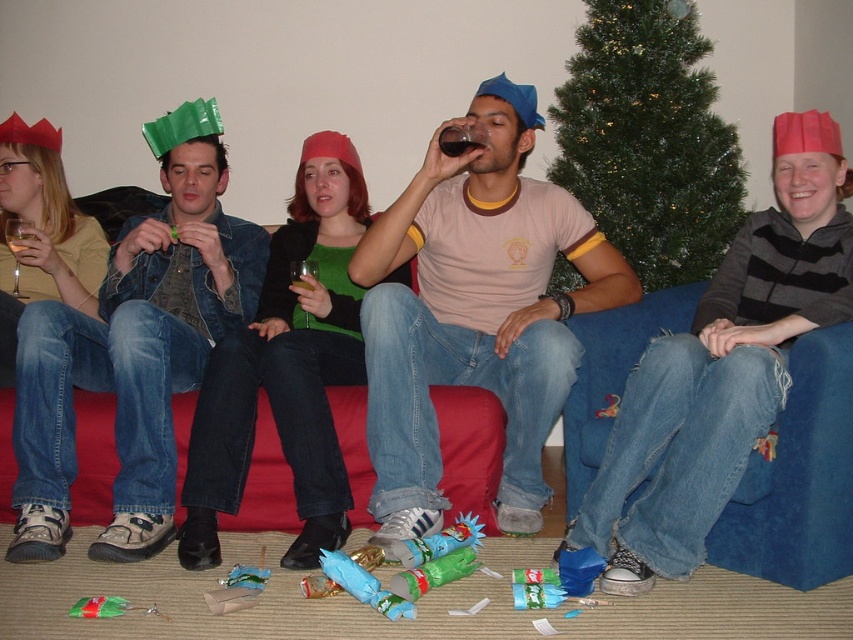
Question: Which point is farther to the camera?

Choices:
 (A) green artificial christmas tree at upper center
 (B) translucent glass at center

Answer: (A)

Question: Which of the following is the closest to the observer?

Choices:
 (A) (808, 529)
 (B) (135, 234)
 (C) (498, 152)

Answer: (A)

Question: Is matte pink t-shirt at center bigger than denim jacket at left?

Choices:
 (A) yes
 (B) no

Answer: (A)

Question: Does denim jacket at left appear under transparent glass at upper left?

Choices:
 (A) yes
 (B) no

Answer: (A)

Question: Which is nearer to the blue suede couch at lower right?

Choices:
 (A) green artificial christmas tree at upper center
 (B) transparent glass at upper left
 (C) translucent glass at center

Answer: (A)

Question: Is green artificial christmas tree at upper center above transparent glass at upper left?

Choices:
 (A) yes
 (B) no

Answer: (A)